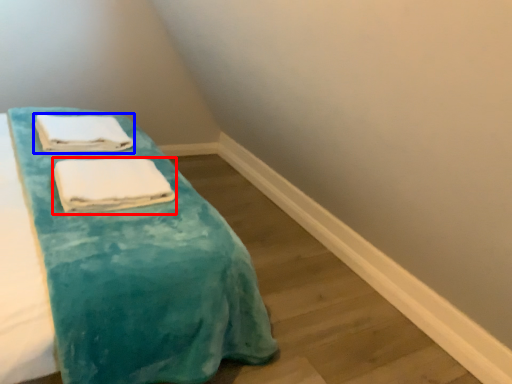
Question: Among these objects, which one is nearest to the camera, towel (highlighted by a red box) or towel (highlighted by a blue box)?

Choices:
 (A) towel
 (B) towel

Answer: (A)